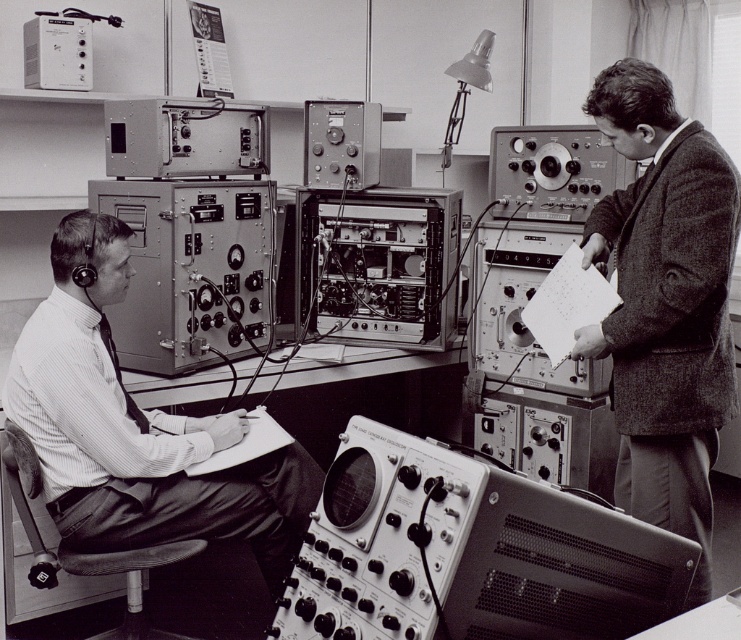
Is point (599, 340) positioned after point (209, 417)?

No, (599, 340) is in front of (209, 417).

Based on the photo, is textured wool blazer at center right bigger than matte black shirt at left?

Actually, textured wool blazer at center right might be smaller than matte black shirt at left.

You are a GUI agent. You are given a task and a screenshot of the screen. Output one action in this format:
    pyautogui.click(x=<x>, y=<y>)
    Task: Click on the textured wool blazer at center right
    
    Given the screenshot: What is the action you would take?
    pyautogui.click(x=664, y=301)

The height and width of the screenshot is (640, 741). Identify the location of textured wool blazer at center right. (664, 301).

Is metallic silver oscilloscope at center thinner than textured wool blazer at center right?

Incorrect, metallic silver oscilloscope at center's width is not less than textured wool blazer at center right's.

Between metallic silver oscilloscope at center and textured wool blazer at center right, which one is positioned higher?

textured wool blazer at center right is above.

Which is in front, point (355, 582) or point (677, 378)?

Point (355, 582) is in front.

I want to click on metallic silver oscilloscope at center, so click(x=468, y=552).

Who is more forward, (536,620) or (84,324)?

Point (536,620)

Is metallic silver oscilloscope at center above matte black shirt at left?

Incorrect, metallic silver oscilloscope at center is not positioned above matte black shirt at left.

Is point (611, 582) farther from camera compared to point (59, 276)?

No, it is in front of (59, 276).

The image size is (741, 640). Find the location of `metallic silver oscilloscope at center`. metallic silver oscilloscope at center is located at coordinates (468, 552).